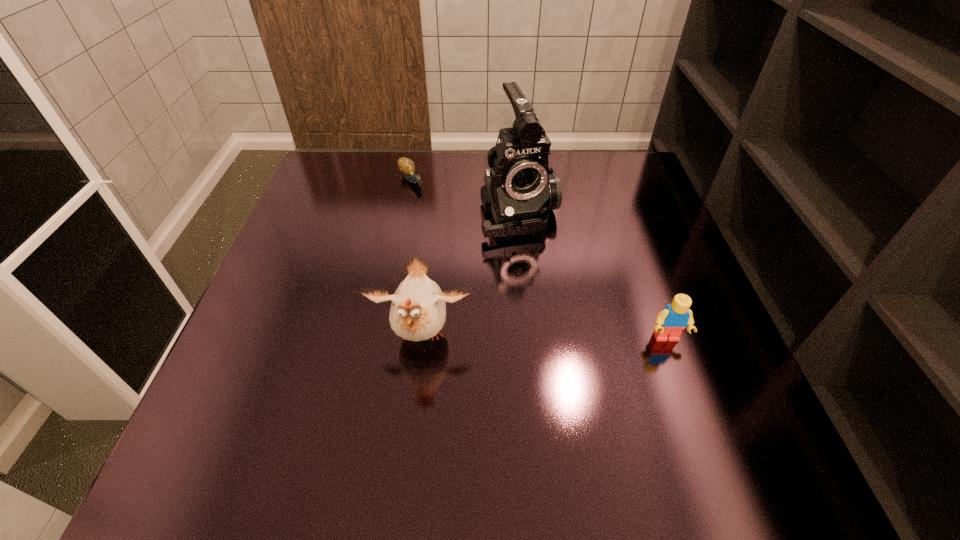
Where is `blank region between the rightmost object and the shortest object`? blank region between the rightmost object and the shortest object is located at coordinates (539, 260).

Find the location of a particular element. object that is the closest to the Lego is located at coordinates (520, 190).

The height and width of the screenshot is (540, 960). Identify the location of the third closest object to the Lego. (407, 166).

At what (x,y) coordinates should I click in order to perform the action: click on free space that satisfies the following two spatial constraints: 1. on the front side of the shortest object; 2. on the left side of the second object from right to left. Please return your answer as a coordinate pair (x, y). The image size is (960, 540). Looking at the image, I should click on (405, 212).